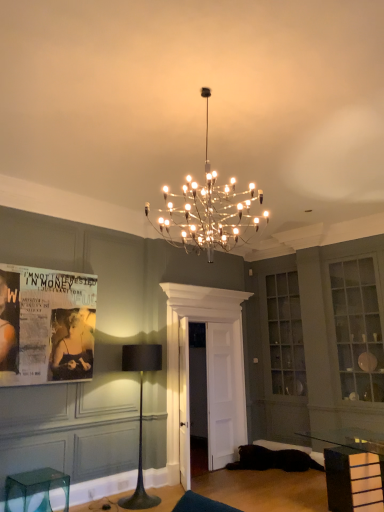
Image resolution: width=384 pixels, height=512 pixels. I want to click on black fabric lamp at center, so click(x=141, y=414).

The width and height of the screenshot is (384, 512). Find the location of `matte paper poster at left`. matte paper poster at left is located at coordinates (46, 325).

The width and height of the screenshot is (384, 512). I want to click on clear glass cabinet at upper right, so click(358, 329).

Between transparent plastic stool at lower left and matte paper poster at left, which one has more height?

matte paper poster at left.

Is transparent plastic stool at lower left outside of matte paper poster at left?

Absolutely, transparent plastic stool at lower left is external to matte paper poster at left.

Image resolution: width=384 pixels, height=512 pixels. I want to click on poster page behind the transparent plastic stool at lower left, so click(46, 325).

Is transparent plastic stool at lower left thinner than matte paper poster at left?

In fact, transparent plastic stool at lower left might be wider than matte paper poster at left.

How many degrees apart are the facing directions of clear glass cabinet at upper right and matte paper poster at left?

88.6 degrees.

Is clear glass cabinet at upper right bigger or smaller than matte paper poster at left?

In the image, clear glass cabinet at upper right appears to be larger than matte paper poster at left.

Does clear glass cabinet at upper right have a greater height compared to matte paper poster at left?

Yes.

Is clear glass cabinet at upper right outside of matte paper poster at left?

Yes, clear glass cabinet at upper right is located beyond the bounds of matte paper poster at left.

From the image's perspective, between clear glass table at lower right and transparent plastic stool at lower left, which one is located above?

clear glass table at lower right, from the image's perspective.

Which is more to the left, clear glass table at lower right or transparent plastic stool at lower left?

transparent plastic stool at lower left is more to the left.

In the image, there is a transparent plastic stool at lower left. Identify the location of table above it (from the image's perspective). The width and height of the screenshot is (384, 512). (352, 471).

Which of these two, clear glass table at lower right or transparent plastic stool at lower left, is thinner?

transparent plastic stool at lower left.

Visually, is transparent plastic stool at lower left positioned to the left or to the right of clear glass table at lower right?

Based on their positions, transparent plastic stool at lower left is located to the left of clear glass table at lower right.

Is transparent plastic stool at lower left positioned before clear glass table at lower right?

No, it is not.

Could you tell me if transparent plastic stool at lower left is facing clear glass table at lower right?

No.

Which of these two, transparent plastic stool at lower left or clear glass table at lower right, is smaller?

transparent plastic stool at lower left.

Is clear glass table at lower right at the back of matte paper poster at left?

matte paper poster at left is not turned away from clear glass table at lower right.

Considering the relative positions of matte paper poster at left and clear glass table at lower right in the image provided, is matte paper poster at left behind clear glass table at lower right?

Yes, matte paper poster at left is further from the viewer.

Can you confirm if matte paper poster at left is thinner than clear glass table at lower right?

Indeed, matte paper poster at left has a lesser width compared to clear glass table at lower right.

Based on their sizes in the image, would you say matte paper poster at left is bigger or smaller than clear glass table at lower right?

matte paper poster at left is smaller than clear glass table at lower right.

Which object is positioned more to the left, clear glass table at lower right or matte paper poster at left?

Positioned to the left is matte paper poster at left.

Considering the sizes of clear glass table at lower right and matte paper poster at left in the image, is clear glass table at lower right bigger or smaller than matte paper poster at left?

Clearly, clear glass table at lower right is larger in size than matte paper poster at left.

Is the depth of clear glass table at lower right greater than that of matte paper poster at left?

No, clear glass table at lower right is closer to the camera.

From a real-world perspective, is clear glass table at lower right above or below matte paper poster at left?

In terms of real-world spatial position, clear glass table at lower right is below matte paper poster at left.

You are a GUI agent. You are given a task and a screenshot of the screen. Output one action in this format:
    pyautogui.click(x=<x>, y=<y>)
    Task: Click on the cabinetry above the clear glass table at lower right (from a real-world perspective)
    This screenshot has width=384, height=512.
    Given the screenshot: What is the action you would take?
    pyautogui.click(x=358, y=329)

Consider the image. Which of these two, clear glass cabinet at upper right or clear glass table at lower right, is bigger?

clear glass cabinet at upper right.

From the image's perspective, would you say clear glass cabinet at upper right is shown under clear glass table at lower right?

No, from the image's perspective, clear glass cabinet at upper right is not beneath clear glass table at lower right.

This screenshot has height=512, width=384. Find the location of `poster page that is behind the transparent plastic stool at lower left`. poster page that is behind the transparent plastic stool at lower left is located at coordinates [46, 325].

At what (x,y) coordinates should I click in order to perform the action: click on cabinetry below the matte paper poster at left (from a real-world perspective). Please return your answer as a coordinate pair (x, y). Looking at the image, I should click on (358, 329).

From the image, which object appears to be farther from matte paper poster at left, clear glass cabinet at upper right or black fabric lamp at center?

clear glass cabinet at upper right.

Estimate the real-world distances between objects in this image. Which object is further from clear glass table at lower right, clear glass cabinet at upper right or transparent plastic stool at lower left?

The object further to clear glass table at lower right is transparent plastic stool at lower left.

Looking at the image, which one is located further to matte paper poster at left, transparent plastic stool at lower left or clear glass cabinet at upper right?

clear glass cabinet at upper right lies further to matte paper poster at left than the other object.

Looking at this image, from the image, which object appears to be nearer to black fabric lamp at center, clear glass cabinet at upper right or matte paper poster at left?

matte paper poster at left.

Considering their positions, is clear glass cabinet at upper right positioned further to matte paper poster at left than clear glass table at lower right?

The object further to matte paper poster at left is clear glass cabinet at upper right.

Estimate the real-world distances between objects in this image. Which object is closer to clear glass table at lower right, transparent plastic stool at lower left or black fabric lamp at center?

Based on the image, black fabric lamp at center appears to be nearer to clear glass table at lower right.

Which object lies further to the anchor point matte paper poster at left, clear glass table at lower right or clear glass cabinet at upper right?

clear glass cabinet at upper right is positioned further to the anchor matte paper poster at left.

Based on their spatial positions, is transparent plastic stool at lower left or clear glass table at lower right further from clear glass cabinet at upper right?

The object further to clear glass cabinet at upper right is transparent plastic stool at lower left.

The image size is (384, 512). In order to click on table lamp located between matte paper poster at left and clear glass cabinet at upper right in the left-right direction in this screenshot , I will do `click(141, 414)`.

What are the coordinates of `table located between black fabric lamp at center and clear glass cabinet at upper right in the left-right direction` in the screenshot? It's located at (352, 471).

Where is `furniture between matte paper poster at left and clear glass cabinet at upper right from left to right`? furniture between matte paper poster at left and clear glass cabinet at upper right from left to right is located at coordinates (36, 489).

Where is `table lamp situated between matte paper poster at left and clear glass table at lower right from left to right`? This screenshot has width=384, height=512. table lamp situated between matte paper poster at left and clear glass table at lower right from left to right is located at coordinates (141, 414).